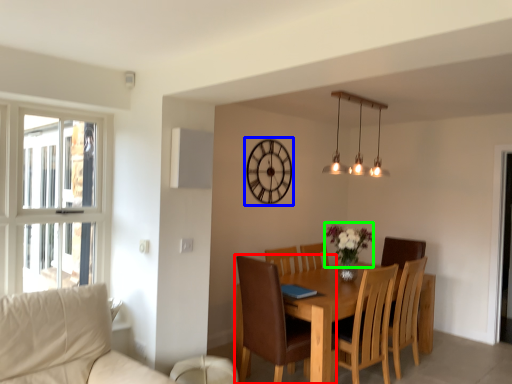
Question: Which object is the closest to the chair (highlighted by a red box)? Choose among these: clock (highlighted by a blue box) or flower (highlighted by a green box).

Choices:
 (A) clock
 (B) flower

Answer: (B)